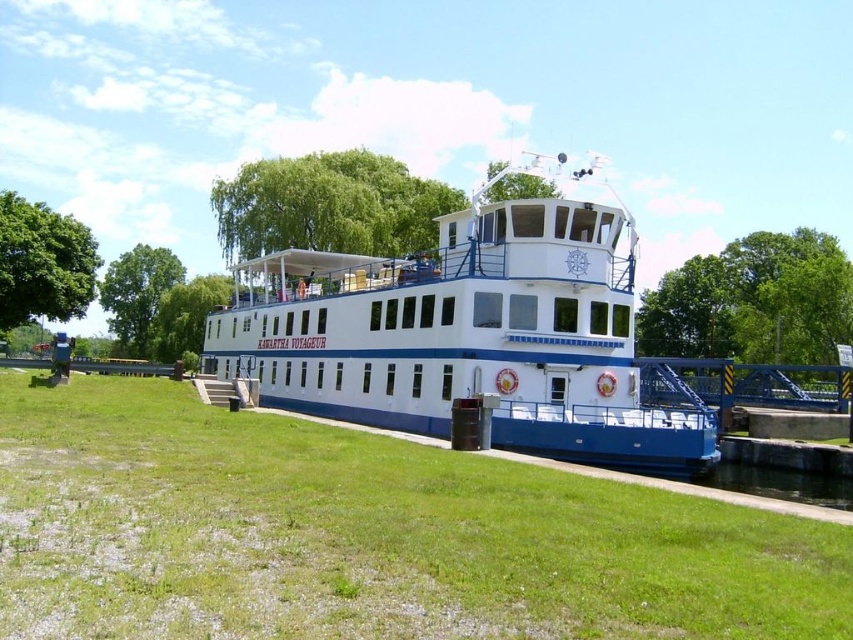
Is green leafy tree at upper center to the right of green leafy tree at left from the viewer's perspective?

Correct, you'll find green leafy tree at upper center to the right of green leafy tree at left.

The image size is (853, 640). In order to click on green leafy tree at upper center in this screenshot , I will do `click(329, 205)`.

Can you confirm if green grass at lower left is thinner than white matte boat at center?

Correct, green grass at lower left's width is less than white matte boat at center's.

Does green grass at lower left appear under white matte boat at center?

Correct, green grass at lower left is located below white matte boat at center.

Which is behind, point (233, 492) or point (666, 410)?

Positioned behind is point (666, 410).

This screenshot has width=853, height=640. I want to click on green grass at lower left, so click(x=364, y=536).

Between point (479, 515) and point (181, 342), which one is positioned in front?

Point (479, 515) is in front.

Is the position of green grass at lower left less distant than that of green leafy tree at center?

That is True.

Which is behind, point (152, 484) or point (175, 337)?

The point (175, 337) is more distant.

Where is `green grass at lower left`? The image size is (853, 640). green grass at lower left is located at coordinates (364, 536).